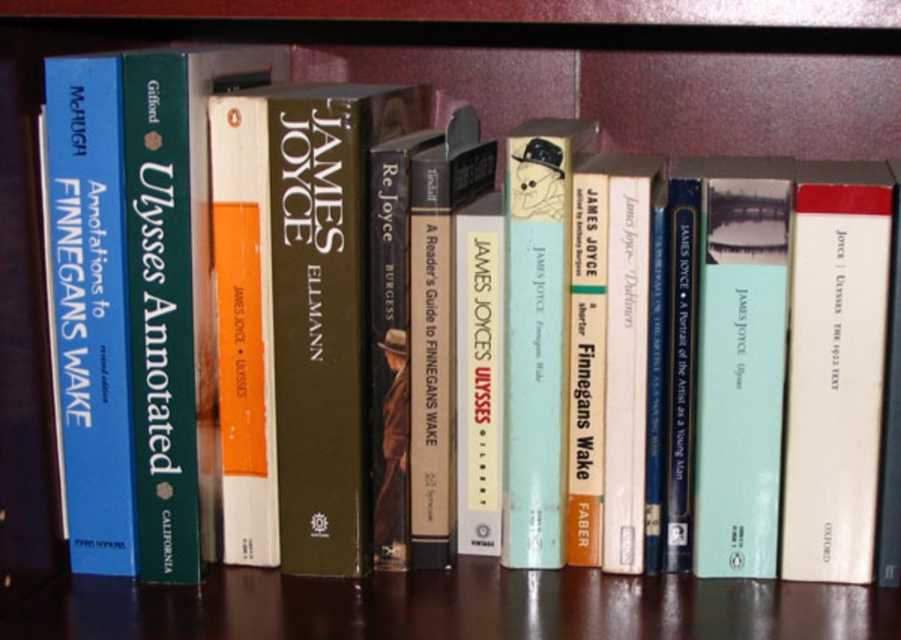
Question: Can you confirm if wooden table at center is wider than white paper at center?

Choices:
 (A) yes
 (B) no

Answer: (A)

Question: Which of the following is the closest to the observer?

Choices:
 (A) white paper at center
 (B) wooden table at center

Answer: (B)

Question: From the image, what is the correct spatial relationship of wooden table at center in relation to white paper at center?

Choices:
 (A) above
 (B) below

Answer: (B)

Question: Is wooden table at center positioned in front of white paper at center?

Choices:
 (A) yes
 (B) no

Answer: (A)